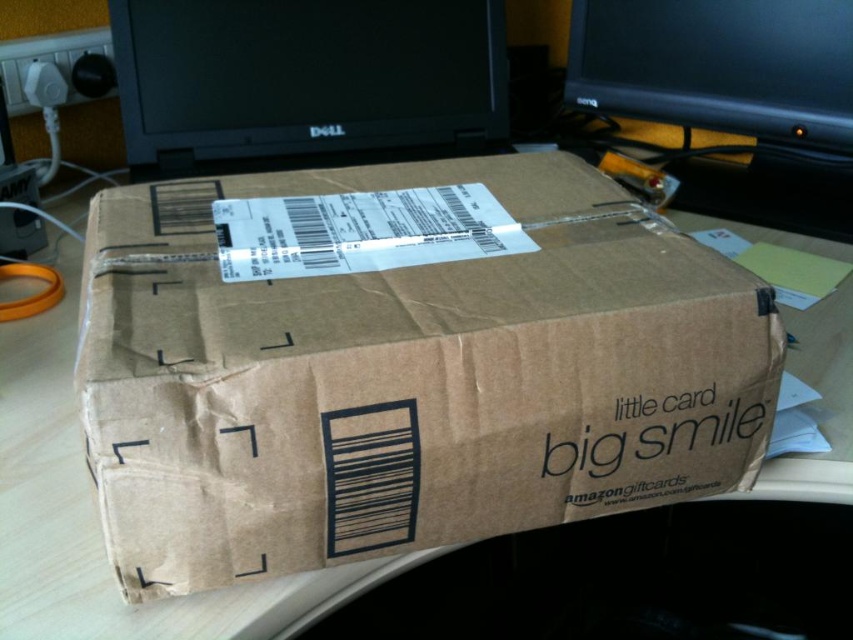
Who is lower down, black glossy monitor at upper center or black glossy monitor at upper right?

Positioned lower is black glossy monitor at upper center.

Identify the location of black glossy monitor at upper center. The height and width of the screenshot is (640, 853). (306, 83).

Is brown cardboard box at center wider than black glossy monitor at upper center?

Yes.

Which of these two, brown cardboard box at center or black glossy monitor at upper center, stands taller?

brown cardboard box at center is taller.

Where is `brown cardboard box at center`? brown cardboard box at center is located at coordinates (405, 378).

Can you confirm if brown cardboard box at center is smaller than black glossy monitor at upper right?

No, brown cardboard box at center is not smaller than black glossy monitor at upper right.

Is point (635, 212) closer to viewer compared to point (606, 17)?

That is True.

You are a GUI agent. You are given a task and a screenshot of the screen. Output one action in this format:
    pyautogui.click(x=<x>, y=<y>)
    Task: Click on the brown cardboard box at center
    The image size is (853, 640).
    Given the screenshot: What is the action you would take?
    pyautogui.click(x=405, y=378)